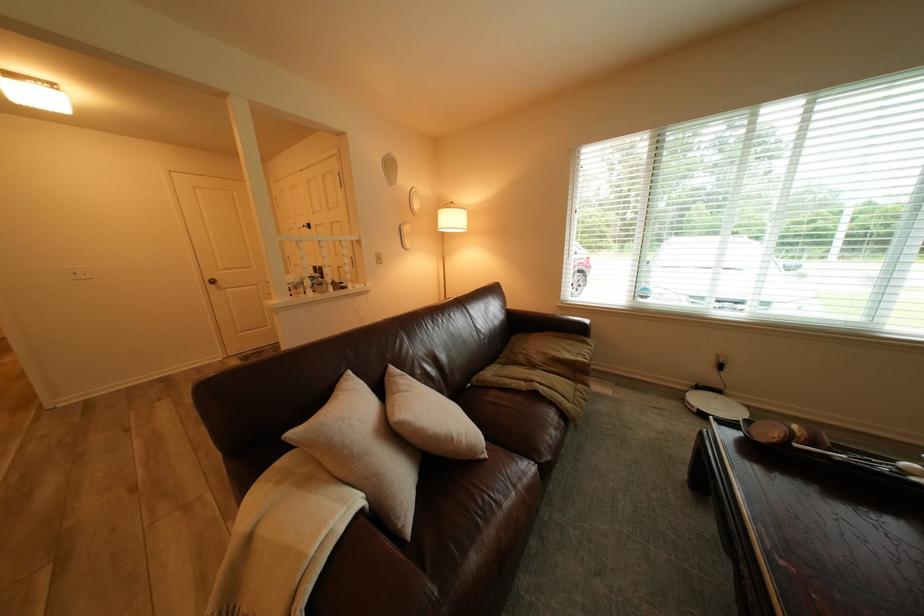
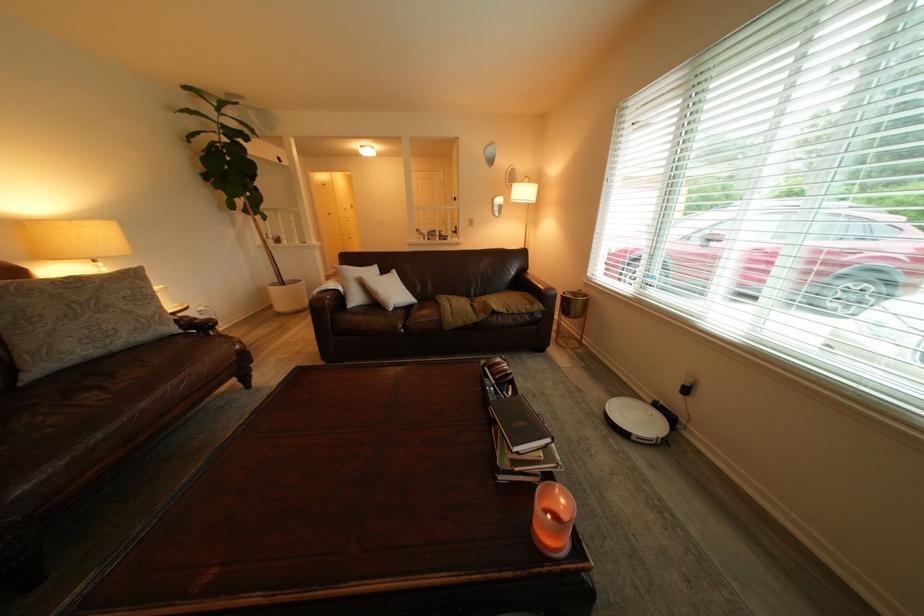
In the second image, find the point that corresponds to (553,384) in the first image.

(465, 305)